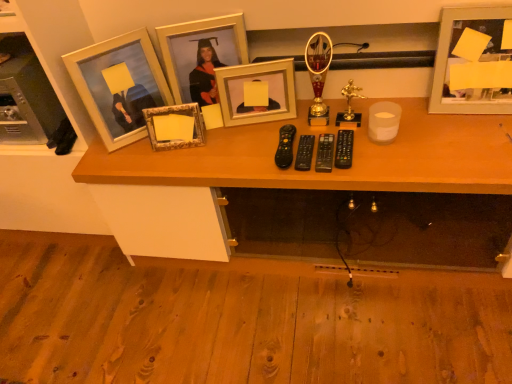
You are a GUI agent. You are given a task and a screenshot of the screen. Output one action in this format:
    pyautogui.click(x=<x>, y=<y>)
    Task: Click on the free location to the left of gold textured photo frame at center, which is the fourth picture frame in right-to-left order
    This screenshot has height=384, width=512.
    Given the screenshot: What is the action you would take?
    pyautogui.click(x=131, y=157)